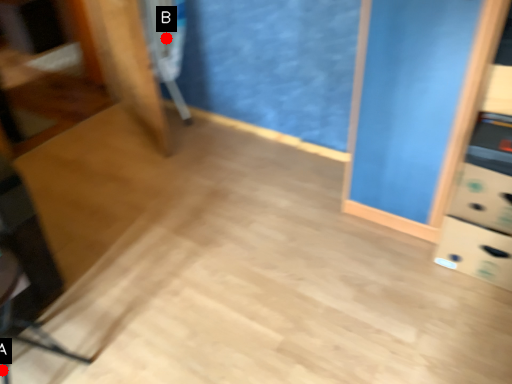
Question: Two points are circled on the image, labeled by A and B beside each circle. Which point appears closest to the camera in this image?

Choices:
 (A) A is closer
 (B) B is closer

Answer: (A)